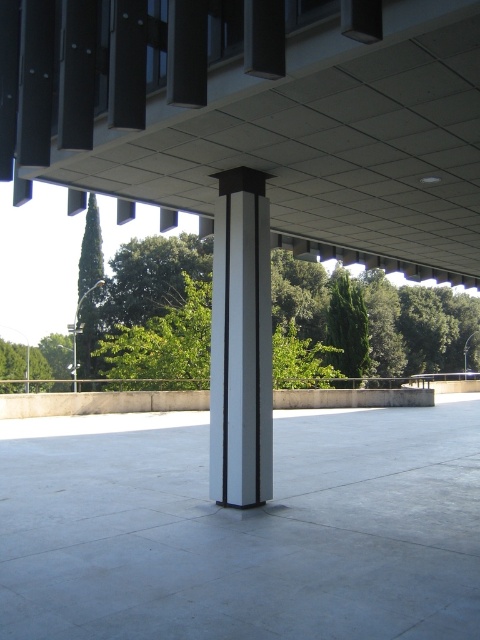
Question: Is metallic gray column at center bigger than green leafy tree at left?

Choices:
 (A) no
 (B) yes

Answer: (A)

Question: Among these objects, which one is farthest from the camera?

Choices:
 (A) green leafy tree at left
 (B) gray concrete at center

Answer: (A)

Question: Is white glossy column at center below gray concrete at center?

Choices:
 (A) no
 (B) yes

Answer: (A)

Question: Which point is closer to the camera taking this photo?

Choices:
 (A) (228, 172)
 (B) (165, 54)
 (C) (13, 451)

Answer: (B)

Question: Considering the real-world distances, which object is farthest from the white glossy column at center?

Choices:
 (A) metallic gray column at center
 (B) gray concrete at center

Answer: (B)

Question: Considering the relative positions of white glossy column at center and metallic gray column at center in the image provided, where is white glossy column at center located with respect to metallic gray column at center?

Choices:
 (A) left
 (B) right

Answer: (B)